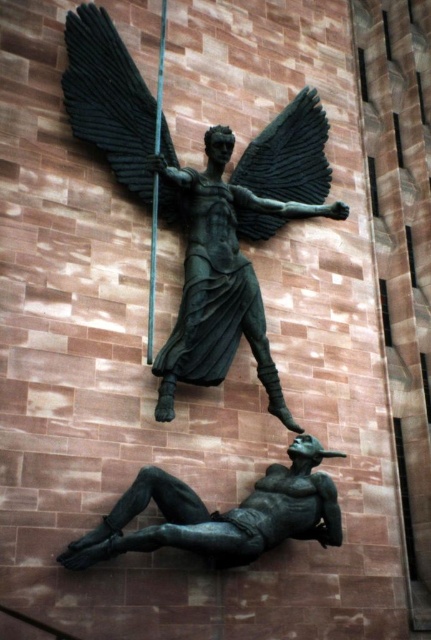
Consider the image. You are an art conservator examining the bronze sculpture. You notice two points of concern on the sculpture, labeled as point (122, 161) and point (153, 337). Which point is closer to you when standing directly in front of the sculpture?

Point (122, 161) is further to the viewer than point (153, 337). Therefore, point (122, 161) is closer to you.

You are an art student analyzing the sculpture. You notice the black matte wing at upper center and the green patina spear at upper center. Which object is shorter in height?

The black matte wing at upper center is not as tall as the green patina spear at upper center, so the black matte wing at upper center is shorter in height.